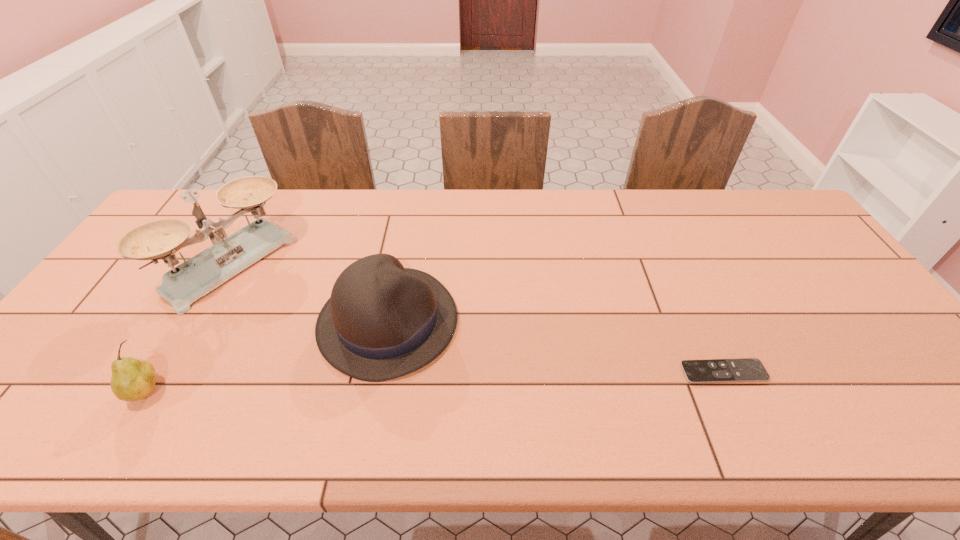
In order to click on vacant area that lies between the pear and the remote control in this screenshot , I will do `click(436, 381)`.

Locate an element on the screen. vacant space that is in between the pear and the tallest object is located at coordinates (190, 328).

Where is `vacant point located between the remote control and the second object from right to left`? Image resolution: width=960 pixels, height=540 pixels. vacant point located between the remote control and the second object from right to left is located at coordinates (556, 347).

Locate an element on the screen. The image size is (960, 540). vacant space that is in between the shortest object and the scale is located at coordinates (478, 319).

At what (x,y) coordinates should I click in order to perform the action: click on vacant space that's between the remote control and the bowler hat. Please return your answer as a coordinate pair (x, y). Looking at the image, I should click on (556, 347).

Choose which object is the nearest neighbor to the shortest object. Please provide its 2D coordinates. Your answer should be formatted as a tuple, i.e. [(x, y)], where the tuple contains the x and y coordinates of a point satisfying the conditions above.

[(383, 321)]

Select which object is the second closest to the second shortest object. Please provide its 2D coordinates. Your answer should be formatted as a tuple, i.e. [(x, y)], where the tuple contains the x and y coordinates of a point satisfying the conditions above.

[(383, 321)]

Where is `vacant area that satisfies the following two spatial constraints: 1. on the back side of the second tallest object; 2. on the right side of the pear`? This screenshot has height=540, width=960. vacant area that satisfies the following two spatial constraints: 1. on the back side of the second tallest object; 2. on the right side of the pear is located at coordinates (189, 322).

The height and width of the screenshot is (540, 960). Find the location of `free location that satisfies the following two spatial constraints: 1. on the front side of the third object from left to right; 2. on the left side of the scale`. free location that satisfies the following two spatial constraints: 1. on the front side of the third object from left to right; 2. on the left side of the scale is located at coordinates (200, 322).

Where is `vacant space that satisfies the following two spatial constraints: 1. on the back side of the second shortest object; 2. on the left side of the bowler hat`? The width and height of the screenshot is (960, 540). vacant space that satisfies the following two spatial constraints: 1. on the back side of the second shortest object; 2. on the left side of the bowler hat is located at coordinates (189, 322).